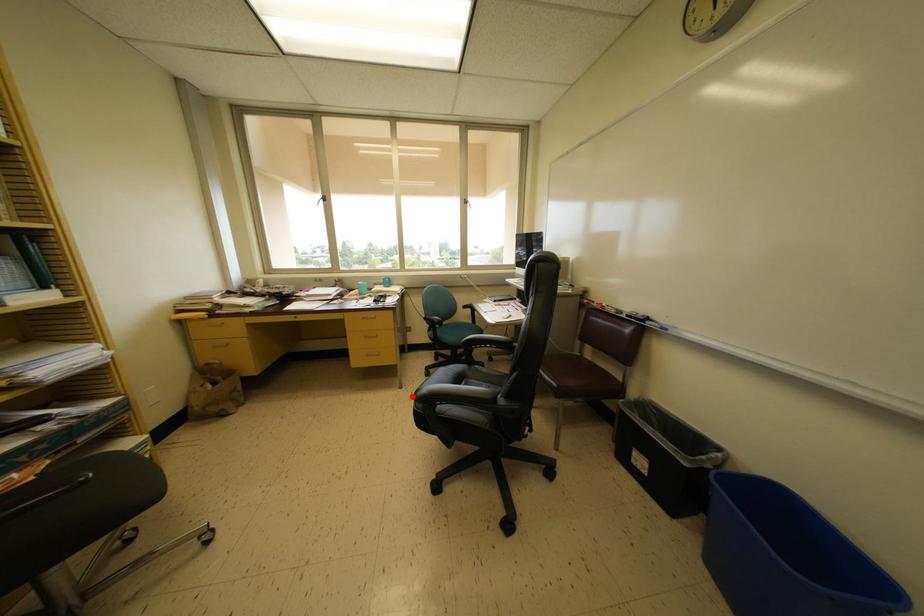
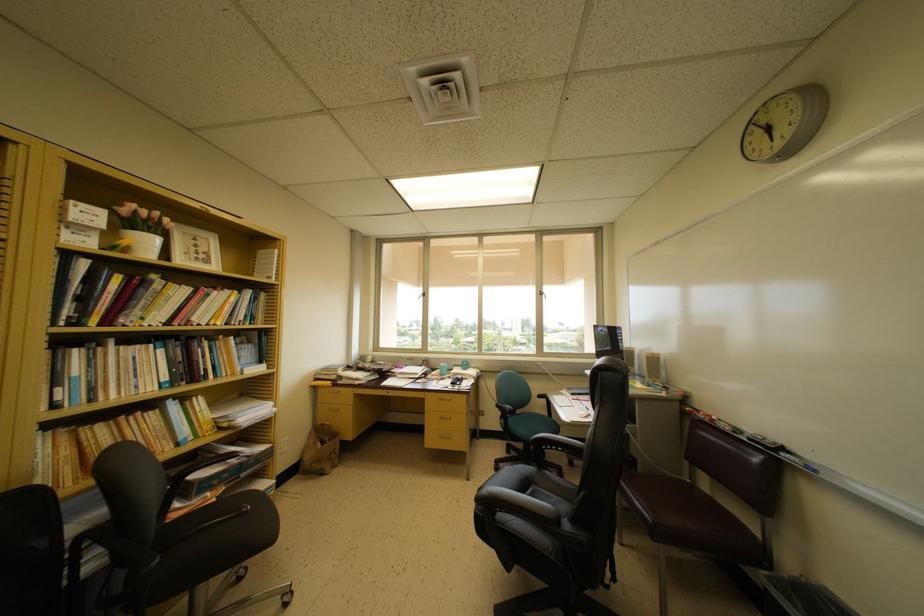
Question: A red point is marked in image1. In image2, is the corresponding 3D point closer to the camera or farther? Reply with the corresponding letter.

Choices:
 (A) The corresponding 3D point is closer.
 (B) The corresponding 3D point is farther.

Answer: (B)